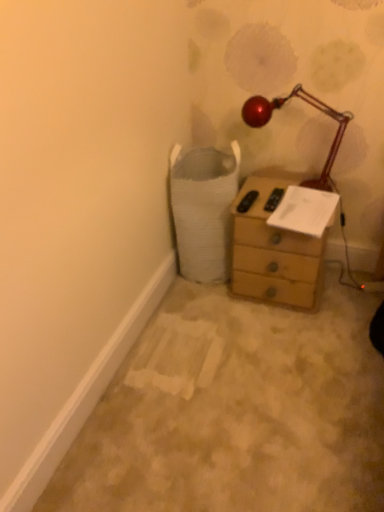
Find the location of a particular element. Image resolution: width=384 pixels, height=512 pixels. empty space that is ontop of wooden chest of drawers at center (from a real-world perspective) is located at coordinates tap(284, 198).